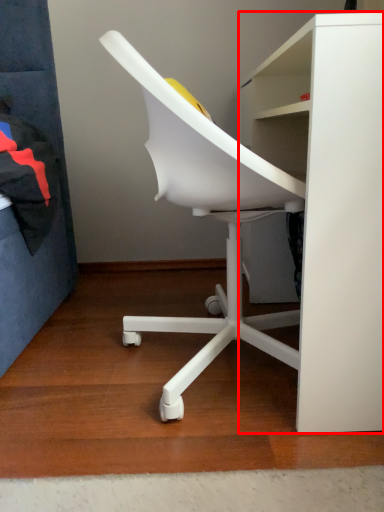
Question: From the image's perspective, considering the relative positions of desk (annotated by the red box) and chair in the image provided, where is desk (annotated by the red box) located with respect to the staircase?

Choices:
 (A) below
 (B) above

Answer: (B)